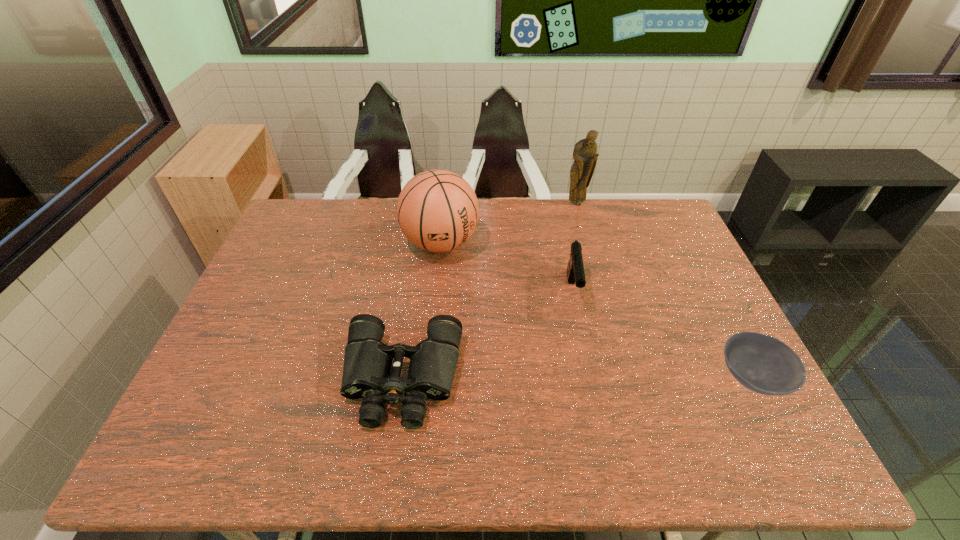
The height and width of the screenshot is (540, 960). Identify the location of the fourth tallest object. (367, 366).

Find the location of a particular element. This screenshot has width=960, height=540. bowl is located at coordinates (761, 363).

The image size is (960, 540). I want to click on the rightmost object, so click(x=761, y=363).

In order to click on the fourth object from left to right in this screenshot , I will do `click(585, 155)`.

Find the location of a particular element. The height and width of the screenshot is (540, 960). the farthest object is located at coordinates (585, 155).

Identify the location of basketball. This screenshot has height=540, width=960. (437, 210).

Where is `the third tallest object`? The image size is (960, 540). the third tallest object is located at coordinates (575, 270).

You are a GUI agent. You are given a task and a screenshot of the screen. Output one action in this format:
    pyautogui.click(x=<x>, y=<y>)
    Task: Click on the third farthest object
    
    Given the screenshot: What is the action you would take?
    pyautogui.click(x=575, y=270)

Where is `vacant space situated on the back of the bowl`? vacant space situated on the back of the bowl is located at coordinates (686, 253).

The image size is (960, 540). I want to click on blank space located on the front-facing side of the figurine, so click(x=576, y=215).